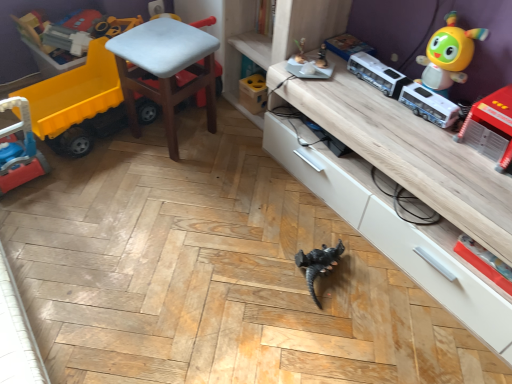
Image resolution: width=512 pixels, height=384 pixels. I want to click on vacant space in front of rubber yellow truck at left, the first toy viewed from the left, so click(x=100, y=186).